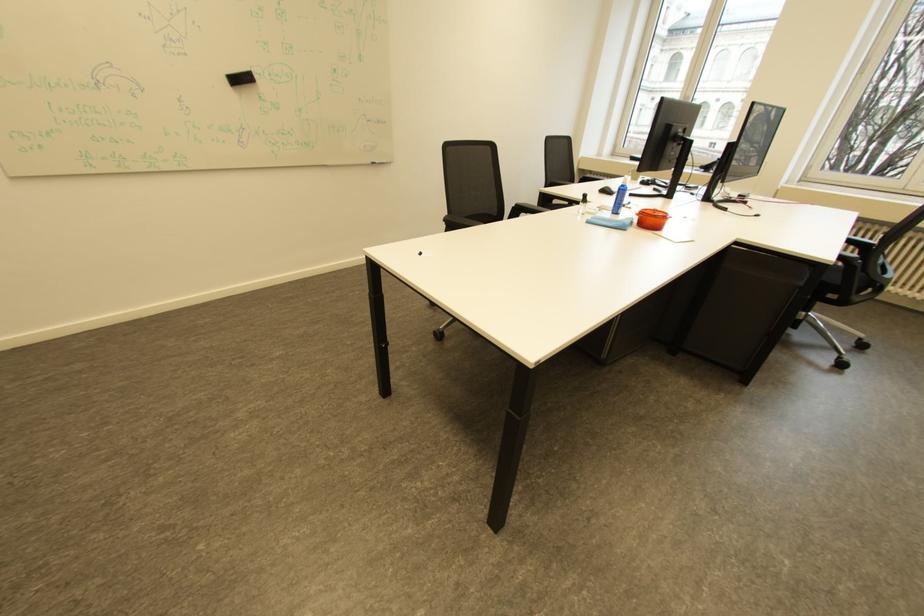
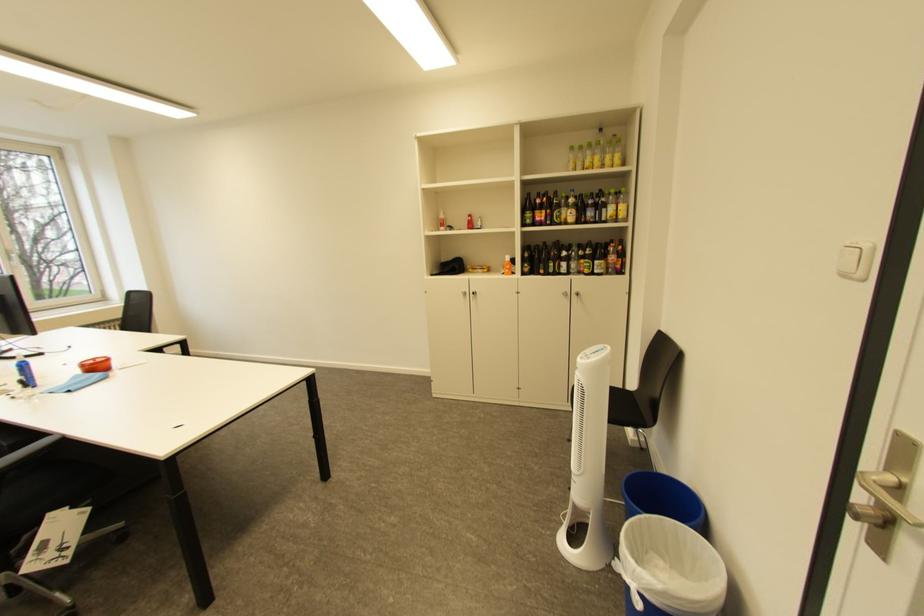
Question: I am providing you with two images of the same scene from different viewpoints. Which of the following objects are not visible in image2?

Choices:
 (A) cabinet handle
 (B) wooden clothespin
 (C) orange container lid
 (D) chair armrest

Answer: (D)